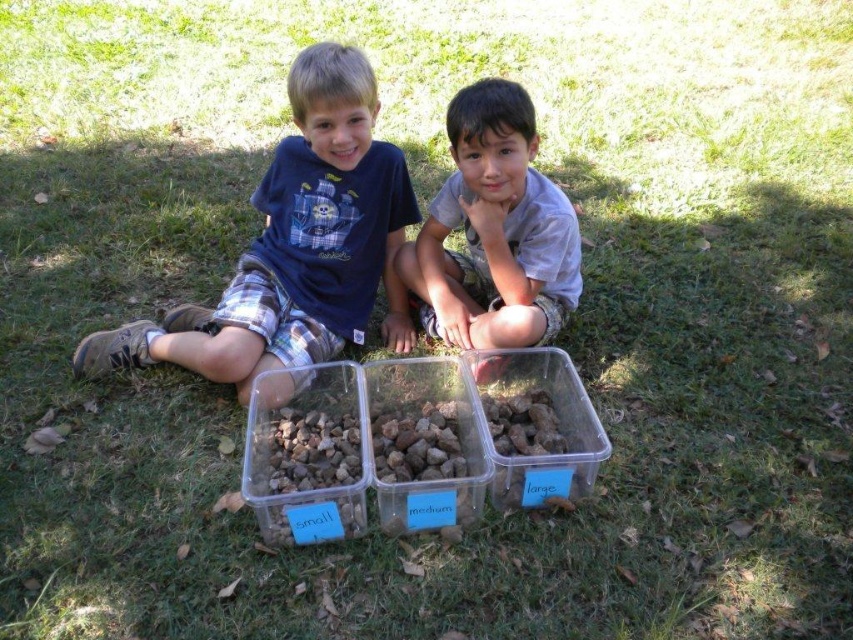
Question: Which object is closer to the camera taking this photo?

Choices:
 (A) translucent plastic container at center
 (B) gray cotton shirt at center

Answer: (A)

Question: Which point is closer to the camera?

Choices:
 (A) (555, 381)
 (B) (573, 250)
 (C) (334, 52)

Answer: (C)

Question: Is matte blue shirt at center further to the viewer compared to translucent plastic container at center?

Choices:
 (A) no
 (B) yes

Answer: (B)

Question: Is matte blue shirt at center wider than translucent plastic container at center?

Choices:
 (A) no
 (B) yes

Answer: (B)

Question: Which object is positioned closest to the matte blue shirt at center?

Choices:
 (A) translucent plastic container at center
 (B) gray cotton shirt at center

Answer: (B)

Question: Is matte blue shirt at center below gray cotton shirt at center?

Choices:
 (A) yes
 (B) no

Answer: (A)